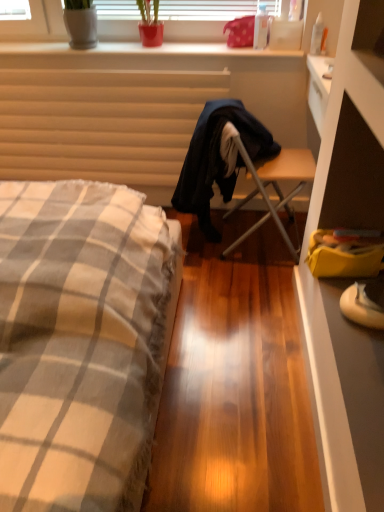
The width and height of the screenshot is (384, 512). I want to click on vacant region to the right of checkered fabric bed at left, so click(x=237, y=373).